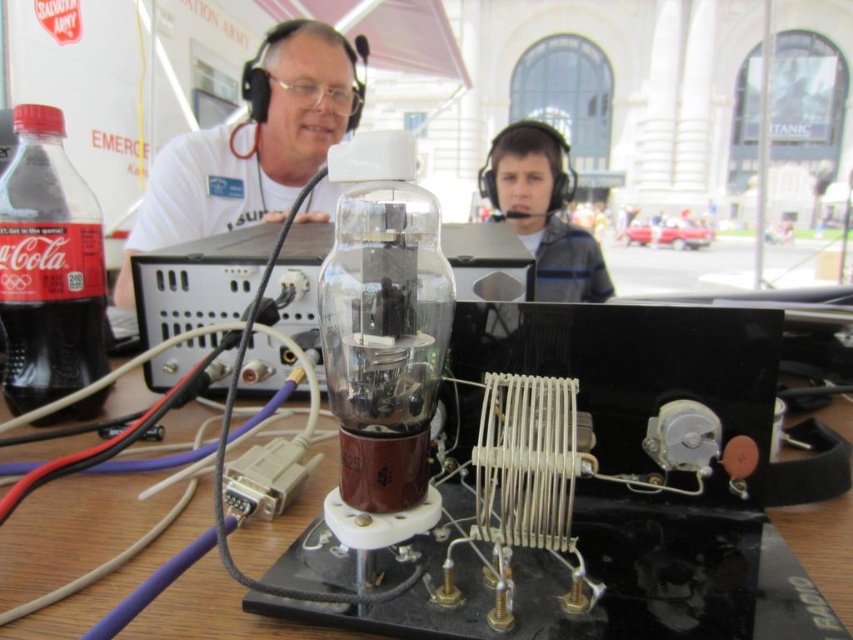
Question: In this image, where is red matte plastic bottle at left located relative to matte gray hoodie at center?

Choices:
 (A) left
 (B) right

Answer: (A)

Question: Which point is closer to the camera taking this photo?

Choices:
 (A) (44, 216)
 (B) (323, 134)
 (C) (608, 284)

Answer: (A)

Question: Which object appears farthest from the camera in this image?

Choices:
 (A) matte gray hoodie at center
 (B) white matte glass tube at center
 (C) red matte plastic bottle at left

Answer: (A)

Question: Estimate the real-world distances between objects in this image. Which object is closer to the white matte glass tube at center?

Choices:
 (A) matte gray hoodie at center
 (B) red matte plastic bottle at left

Answer: (A)

Question: Is white matte glass tube at center below red matte plastic bottle at left?

Choices:
 (A) no
 (B) yes

Answer: (A)

Question: Is white matte glass tube at center below matte gray hoodie at center?

Choices:
 (A) yes
 (B) no

Answer: (B)